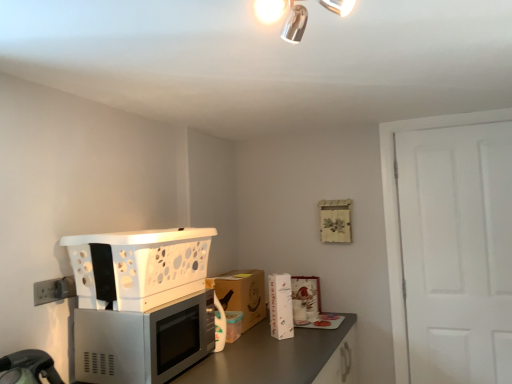
This screenshot has width=512, height=384. Find the location of `free space above white matte door at right (from a real-world perspective)`. free space above white matte door at right (from a real-world perspective) is located at coordinates (457, 119).